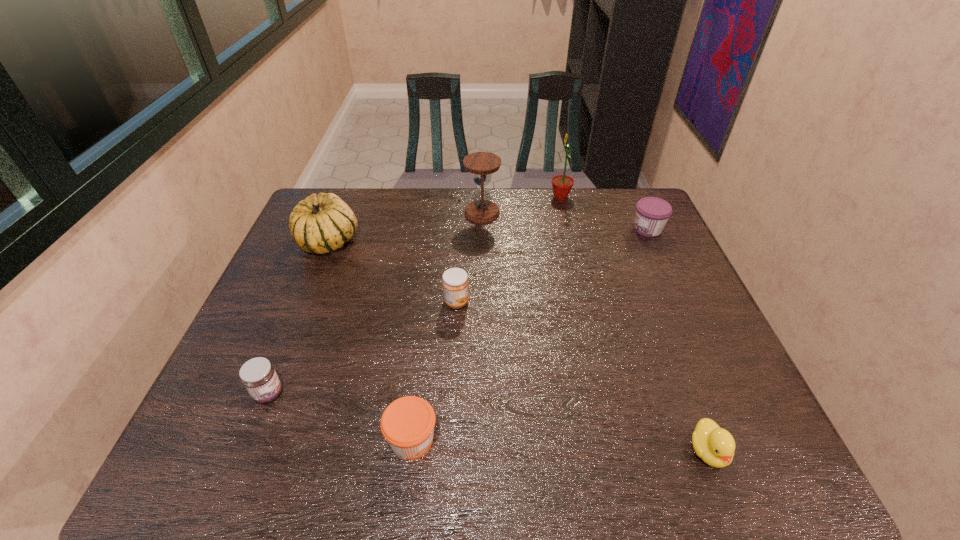
I want to click on free point located on the front label of the nearest jam, so click(x=577, y=440).

Where is `sunflower present at the far edge`? This screenshot has height=540, width=960. sunflower present at the far edge is located at coordinates (562, 184).

The height and width of the screenshot is (540, 960). I want to click on hourglass that is at the far edge, so click(x=481, y=164).

The image size is (960, 540). I want to click on gourd positioned at the far edge, so click(321, 223).

The image size is (960, 540). I want to click on jam situated at the far edge, so point(652,214).

Where is `jam positioned at the near edge`? The height and width of the screenshot is (540, 960). jam positioned at the near edge is located at coordinates (407, 424).

Where is `duckling present at the near edge`? duckling present at the near edge is located at coordinates tap(715, 446).

In order to click on gourd at the left edge in this screenshot , I will do `click(321, 223)`.

Image resolution: width=960 pixels, height=540 pixels. Find the location of `jam that is positioned at the left edge`. jam that is positioned at the left edge is located at coordinates (258, 375).

Locate an element on the screen. The height and width of the screenshot is (540, 960). jam present at the right edge is located at coordinates (652, 214).